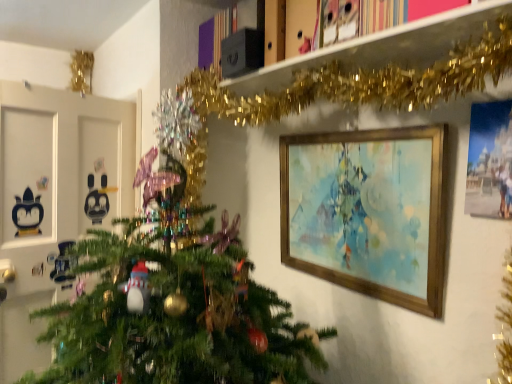
Question: Considering the relative sizes of gold tinsel garland at upper center and wooden picture frame at upper right, which is the first picture frame from left to right, in the image provided, is gold tinsel garland at upper center bigger than wooden picture frame at upper right, which is the first picture frame from left to right,?

Choices:
 (A) yes
 (B) no

Answer: (B)

Question: Can you confirm if gold tinsel garland at upper center is wider than wooden picture frame at upper right, arranged as the first picture frame when viewed from the back?

Choices:
 (A) no
 (B) yes

Answer: (B)

Question: From the image's perspective, would you say gold tinsel garland at upper center is positioned over wooden picture frame at upper right, which is the first picture frame from left to right?

Choices:
 (A) no
 (B) yes

Answer: (B)

Question: Is gold tinsel garland at upper center looking in the opposite direction of wooden picture frame at upper right, which is the first picture frame from left to right?

Choices:
 (A) no
 (B) yes

Answer: (A)

Question: Is the position of gold tinsel garland at upper center less distant than that of wooden picture frame at upper right, marked as the second picture frame in a right-to-left arrangement?

Choices:
 (A) no
 (B) yes

Answer: (B)

Question: Is point (373, 195) closer or farther from the camera than point (489, 190)?

Choices:
 (A) closer
 (B) farther

Answer: (B)

Question: Relative to matte blue painting at upper right, which appears as the second picture frame when viewed from the back, is wooden picture frame at upper right, which is the first picture frame from left to right, in front or behind?

Choices:
 (A) behind
 (B) front

Answer: (A)

Question: Is wooden picture frame at upper right, the second picture frame when ordered from front to back, bigger or smaller than matte blue painting at upper right, which appears as the second picture frame when viewed from the back?

Choices:
 (A) big
 (B) small

Answer: (A)

Question: Looking at their shapes, would you say wooden picture frame at upper right, arranged as the first picture frame when viewed from the back, is wider or thinner than matte blue painting at upper right, which appears as the second picture frame when viewed from the back?

Choices:
 (A) wide
 (B) thin

Answer: (A)

Question: Is matte blue painting at upper right, which appears as the second picture frame when viewed from the back, taller or shorter than gold tinsel garland at upper center?

Choices:
 (A) short
 (B) tall

Answer: (B)

Question: Considering the relative positions of matte blue painting at upper right, positioned as the 1th picture frame in front-to-back order, and gold tinsel garland at upper center in the image provided, is matte blue painting at upper right, positioned as the 1th picture frame in front-to-back order, to the left or to the right of gold tinsel garland at upper center?

Choices:
 (A) left
 (B) right

Answer: (B)

Question: From a real-world perspective, is matte blue painting at upper right, acting as the 1th picture frame starting from the right, physically located above or below gold tinsel garland at upper center?

Choices:
 (A) above
 (B) below

Answer: (B)

Question: In terms of size, does matte blue painting at upper right, acting as the 1th picture frame starting from the right, appear bigger or smaller than gold tinsel garland at upper center?

Choices:
 (A) small
 (B) big

Answer: (A)

Question: Is wooden picture frame at upper right, the second picture frame when ordered from front to back, taller or shorter than gold tinsel garland at upper center?

Choices:
 (A) tall
 (B) short

Answer: (A)

Question: From the image's perspective, relative to gold tinsel garland at upper center, is wooden picture frame at upper right, the second picture frame when ordered from front to back, above or below?

Choices:
 (A) below
 (B) above

Answer: (A)